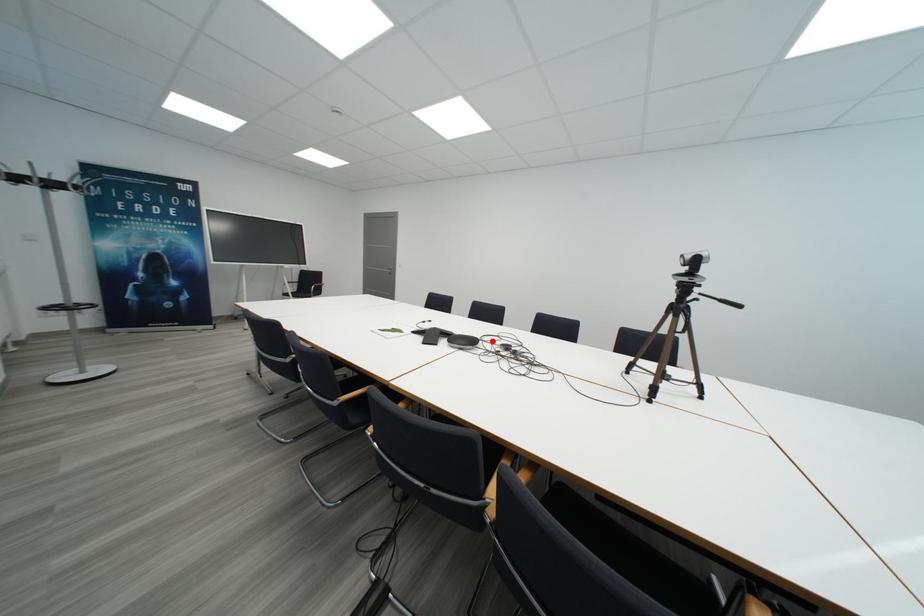
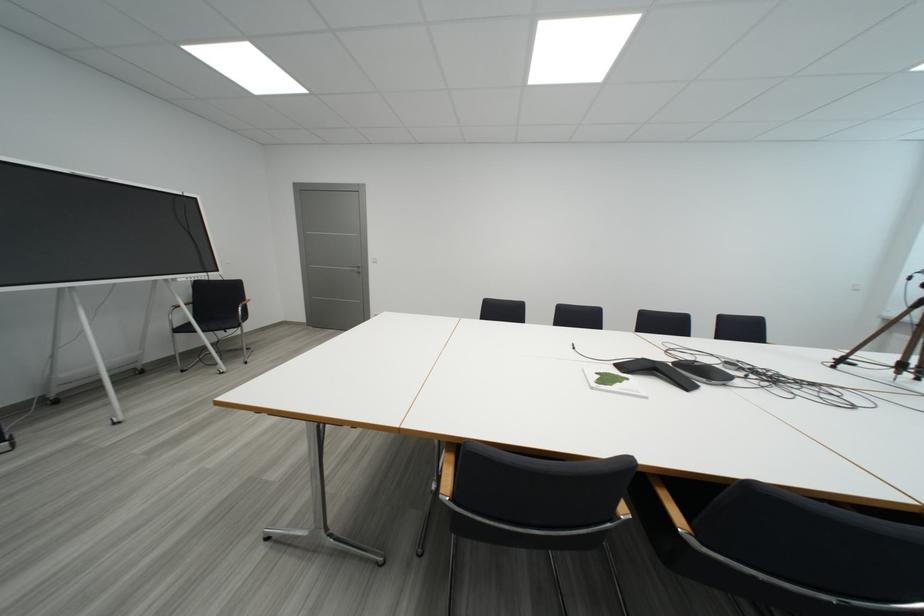
Find the pixel in the second image that matches the highlighted location in the first image.

(697, 361)